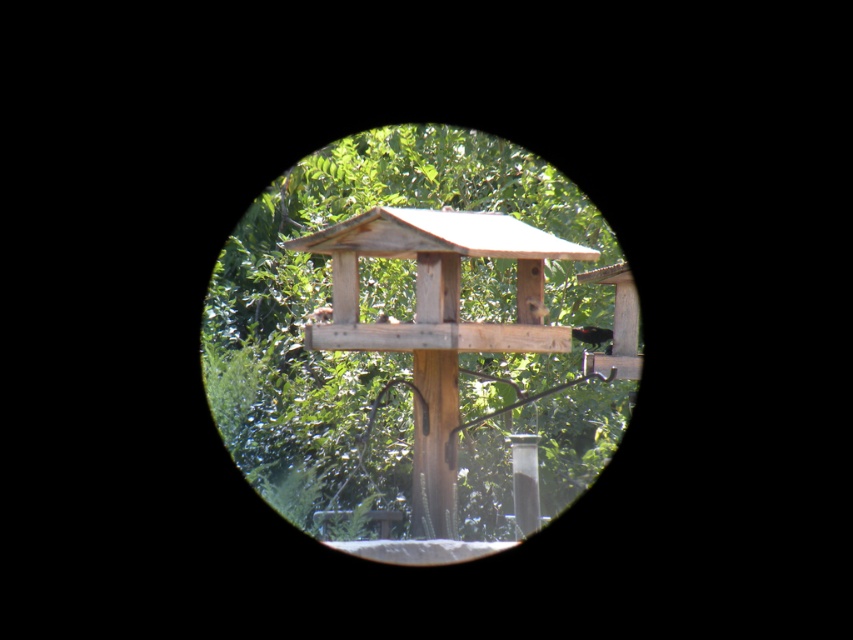
Consider the image. You are a birdwatcher observing the scene through the circular lens. You see a shiny black bird at center and a brown fuzzy bird at center. Which bird is closer to you?

The shiny black bird at center is closer to you because it is further to the viewer than the brown fuzzy bird at center.

You are standing at the edge of a garden and see a shiny black bird at center. If you want to observe it closely without disturbing it, what is the minimum distance you should maintain?

The shiny black bird at center is 5.02 meters away from the viewer. To observe it closely without disturbing it, you should maintain a distance of at least 5.02 meters.

You are a photographer adjusting your camera to focus on the brown matte bird feeder at center. However, you notice a shiny black bird at center in the frame. Which object is closer to your camera lens?

The shiny black bird at center is closer to the camera lens than the brown matte bird feeder at center because it appears further to the viewer according to the description.